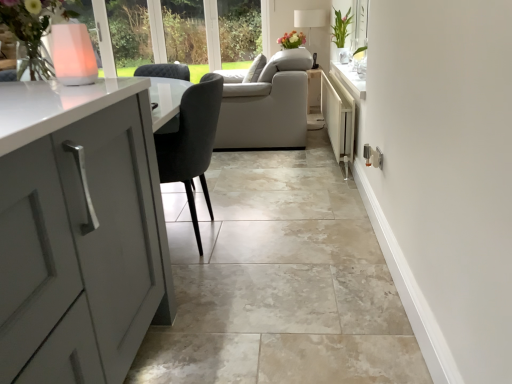
Question: From the image's perspective, is white fabric lampshade at upper center located beneath pink translucent vase at upper left?

Choices:
 (A) yes
 (B) no

Answer: (B)

Question: Considering the relative sizes of white fabric lampshade at upper center and pink translucent vase at upper left in the image provided, is white fabric lampshade at upper center shorter than pink translucent vase at upper left?

Choices:
 (A) no
 (B) yes

Answer: (A)

Question: Can you confirm if white fabric lampshade at upper center is bigger than pink translucent vase at upper left?

Choices:
 (A) yes
 (B) no

Answer: (A)

Question: Is there a large distance between white fabric lampshade at upper center and pink translucent vase at upper left?

Choices:
 (A) no
 (B) yes

Answer: (B)

Question: Can we say white fabric lampshade at upper center lies outside pink translucent vase at upper left?

Choices:
 (A) yes
 (B) no

Answer: (A)

Question: Considering their positions, is white fabric lampshade at upper center located in front of or behind white metallic radiator at center-right?

Choices:
 (A) front
 (B) behind

Answer: (B)

Question: From their relative heights in the image, would you say white fabric lampshade at upper center is taller or shorter than white metallic radiator at center-right?

Choices:
 (A) tall
 (B) short

Answer: (A)

Question: Based on their sizes in the image, would you say white fabric lampshade at upper center is bigger or smaller than white metallic radiator at center-right?

Choices:
 (A) small
 (B) big

Answer: (A)

Question: Is point (309, 44) closer or farther from the camera than point (345, 157)?

Choices:
 (A) farther
 (B) closer

Answer: (A)

Question: Considering the positions of white metallic radiator at center-right and beige marble tile at center in the image, is white metallic radiator at center-right wider or thinner than beige marble tile at center?

Choices:
 (A) wide
 (B) thin

Answer: (B)

Question: Considering their positions, is white metallic radiator at center-right located in front of or behind beige marble tile at center?

Choices:
 (A) front
 (B) behind

Answer: (B)

Question: Visually, is white metallic radiator at center-right positioned to the left or to the right of beige marble tile at center?

Choices:
 (A) right
 (B) left

Answer: (A)

Question: From a real-world perspective, relative to beige marble tile at center, is white metallic radiator at center-right vertically above or below?

Choices:
 (A) below
 (B) above

Answer: (B)

Question: From their relative heights in the image, would you say white fabric lampshade at upper center is taller or shorter than pink translucent vase at upper left?

Choices:
 (A) short
 (B) tall

Answer: (B)

Question: In the image, is white fabric lampshade at upper center positioned in front of or behind pink translucent vase at upper left?

Choices:
 (A) front
 (B) behind

Answer: (B)